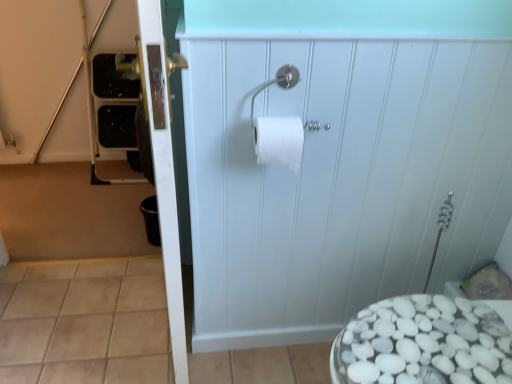
Question: From the image's perspective, does white matte cabinet at center, which is counted as the second screen door, starting from the left, appear higher than silver metallic toilet paper holder at upper center?

Choices:
 (A) yes
 (B) no

Answer: (B)

Question: Can you confirm if white matte cabinet at center, which is counted as the first screen door, starting from the right, is taller than silver metallic toilet paper holder at upper center?

Choices:
 (A) no
 (B) yes

Answer: (B)

Question: From a real-world perspective, is white matte cabinet at center, which is counted as the second screen door, starting from the left, on top of silver metallic toilet paper holder at upper center?

Choices:
 (A) no
 (B) yes

Answer: (A)

Question: Is white matte cabinet at center, which is counted as the first screen door, starting from the right, completely or partially outside of silver metallic toilet paper holder at upper center?

Choices:
 (A) yes
 (B) no

Answer: (A)

Question: Is white matte cabinet at center, which is counted as the second screen door, starting from the left, shorter than silver metallic toilet paper holder at upper center?

Choices:
 (A) yes
 (B) no

Answer: (B)

Question: From a real-world perspective, is white matte toilet paper at center physically located above or below silver metallic toilet paper holder at upper center?

Choices:
 (A) below
 (B) above

Answer: (A)

Question: Visually, is white matte toilet paper at center positioned to the left or to the right of silver metallic toilet paper holder at upper center?

Choices:
 (A) right
 (B) left

Answer: (B)

Question: Is white matte toilet paper at center taller or shorter than silver metallic toilet paper holder at upper center?

Choices:
 (A) tall
 (B) short

Answer: (A)

Question: Do you think white matte toilet paper at center is within silver metallic toilet paper holder at upper center, or outside of it?

Choices:
 (A) outside
 (B) inside

Answer: (A)

Question: Based on their positions, is white matte toilet paper at center located to the left or right of white glossy door at left, the 2th screen door in the right-to-left sequence?

Choices:
 (A) right
 (B) left

Answer: (A)

Question: Is point (289, 147) closer or farther from the camera than point (180, 357)?

Choices:
 (A) closer
 (B) farther

Answer: (A)

Question: Considering the positions of white matte toilet paper at center and white glossy door at left, acting as the first screen door starting from the left, in the image, is white matte toilet paper at center bigger or smaller than white glossy door at left, acting as the first screen door starting from the left,?

Choices:
 (A) small
 (B) big

Answer: (A)

Question: From their relative heights in the image, would you say white matte toilet paper at center is taller or shorter than white glossy door at left, acting as the first screen door starting from the left?

Choices:
 (A) short
 (B) tall

Answer: (A)

Question: Considering the relative positions of white matte cabinet at center, which is counted as the first screen door, starting from the right, and white matte toilet paper at center in the image provided, is white matte cabinet at center, which is counted as the first screen door, starting from the right, to the left or to the right of white matte toilet paper at center?

Choices:
 (A) right
 (B) left

Answer: (A)

Question: From the image's perspective, is white matte cabinet at center, which is counted as the first screen door, starting from the right, positioned above or below white matte toilet paper at center?

Choices:
 (A) above
 (B) below

Answer: (B)